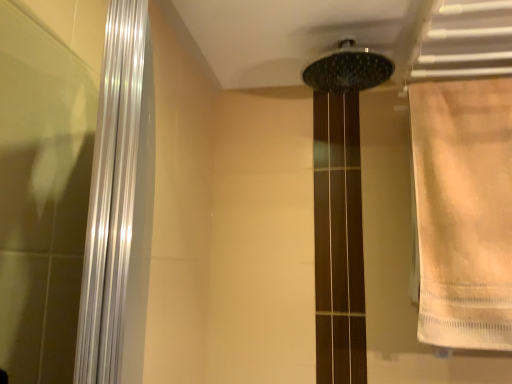
Where is `beige fabric towel at right`? beige fabric towel at right is located at coordinates (463, 211).

What do you see at coordinates (463, 211) in the screenshot? The width and height of the screenshot is (512, 384). I see `beige fabric towel at right` at bounding box center [463, 211].

The height and width of the screenshot is (384, 512). Describe the element at coordinates (348, 69) in the screenshot. I see `black matte shower head at upper center` at that location.

This screenshot has width=512, height=384. What are the coordinates of `black matte shower head at upper center` in the screenshot? It's located at (348, 69).

Where is `beige fabric towel at right`? The image size is (512, 384). beige fabric towel at right is located at coordinates (463, 211).

Does beige fabric towel at right appear on the right side of black matte shower head at upper center?

Yes, beige fabric towel at right is to the right of black matte shower head at upper center.

Is the depth of beige fabric towel at right greater than that of black matte shower head at upper center?

No, beige fabric towel at right is in front of black matte shower head at upper center.

Looking at this image, which point is more forward, (428, 222) or (362, 80)?

The point (428, 222) is closer to the camera.

From the image's perspective, is beige fabric towel at right above or below black matte shower head at upper center?

Based on their image positions, beige fabric towel at right is located beneath black matte shower head at upper center.

From a real-world perspective, between beige fabric towel at right and black matte shower head at upper center, who is vertically lower?

beige fabric towel at right, from a real-world perspective.

Is beige fabric towel at right wider or thinner than black matte shower head at upper center?

beige fabric towel at right is thinner than black matte shower head at upper center.

Which of these two, beige fabric towel at right or black matte shower head at upper center, stands taller?

Standing taller between the two is beige fabric towel at right.

Considering the sizes of objects beige fabric towel at right and black matte shower head at upper center in the image provided, who is smaller, beige fabric towel at right or black matte shower head at upper center?

black matte shower head at upper center.

Do you think beige fabric towel at right is within black matte shower head at upper center, or outside of it?

beige fabric towel at right is not enclosed by black matte shower head at upper center.

Is beige fabric towel at right far from black matte shower head at upper center?

beige fabric towel at right is near black matte shower head at upper center, not far away.

In the scene shown: Is beige fabric towel at right aimed at black matte shower head at upper center?

No, beige fabric towel at right is not facing towards black matte shower head at upper center.

What's the angular difference between beige fabric towel at right and black matte shower head at upper center's facing directions?

1.15e-05 degrees separate the facing orientations of beige fabric towel at right and black matte shower head at upper center.

In order to click on shower curtain that is under the black matte shower head at upper center (from a real-world perspective) in this screenshot , I will do `click(463, 211)`.

Visually, is black matte shower head at upper center positioned to the left or to the right of beige fabric towel at right?

From the image, it's evident that black matte shower head at upper center is to the left of beige fabric towel at right.

Does black matte shower head at upper center lie behind beige fabric towel at right?

Yes, it is.

Considering the positions of point (370, 65) and point (414, 131), is point (370, 65) closer or farther from the camera than point (414, 131)?

Point (370, 65) is closer to the camera than point (414, 131).

From the image's perspective, does black matte shower head at upper center appear higher than beige fabric towel at right?

Yes.

From a real-world perspective, is black matte shower head at upper center physically located above or below beige fabric towel at right?

In terms of real-world spatial position, black matte shower head at upper center is above beige fabric towel at right.

Looking at this image, which object is wider, black matte shower head at upper center or beige fabric towel at right?

Wider between the two is black matte shower head at upper center.

Considering the relative sizes of black matte shower head at upper center and beige fabric towel at right in the image provided, is black matte shower head at upper center shorter than beige fabric towel at right?

Yes, black matte shower head at upper center is shorter than beige fabric towel at right.

Is black matte shower head at upper center bigger than beige fabric towel at right?

No, black matte shower head at upper center is not bigger than beige fabric towel at right.

Choose the correct answer: Is black matte shower head at upper center inside beige fabric towel at right or outside it?

black matte shower head at upper center is not enclosed by beige fabric towel at right.

Is black matte shower head at upper center with beige fabric towel at right?

black matte shower head at upper center and beige fabric towel at right are clearly separated.

Consider the image. Is black matte shower head at upper center turned away from beige fabric towel at right?

No, black matte shower head at upper center is not facing the opposite direction of beige fabric towel at right.

What's the angular difference between black matte shower head at upper center and beige fabric towel at right's facing directions?

1.15e-05 degrees separate the facing orientations of black matte shower head at upper center and beige fabric towel at right.

Where is `shower curtain that appears below the black matte shower head at upper center (from the image's perspective)`? The height and width of the screenshot is (384, 512). shower curtain that appears below the black matte shower head at upper center (from the image's perspective) is located at coordinates (463, 211).

The height and width of the screenshot is (384, 512). I want to click on shower on the left side of beige fabric towel at right, so click(x=348, y=69).

Locate an element on the screen. shower curtain that appears in front of the black matte shower head at upper center is located at coordinates (463, 211).